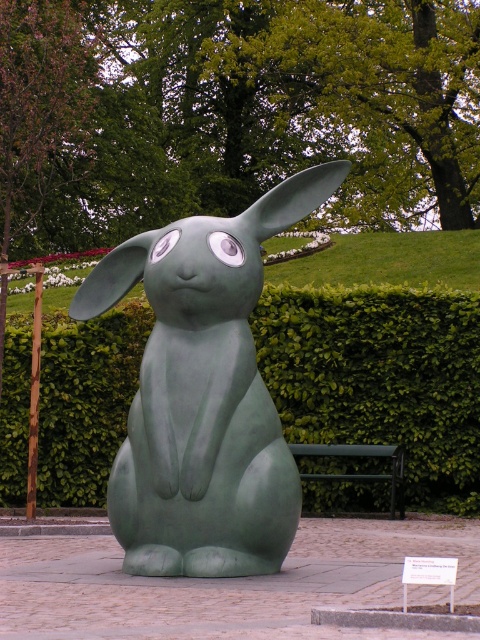
Is green leafy hedge at center shorter than green matte rabbit at center?

Yes, green leafy hedge at center is shorter than green matte rabbit at center.

How distant is green leafy hedge at center from green matte rabbit at center?

A distance of 6.25 meters exists between green leafy hedge at center and green matte rabbit at center.

The height and width of the screenshot is (640, 480). Identify the location of green leafy hedge at center. (380, 378).

Is green matte rabbit at center further to camera compared to green metal bench at center?

No, it is not.

Between point (153, 506) and point (325, 477), which one is positioned in front?

Point (153, 506)

Where is `green matte rabbit at center`? This screenshot has height=640, width=480. green matte rabbit at center is located at coordinates (204, 394).

Does green leafy hedge at center have a smaller size compared to green metal bench at center?

No, green leafy hedge at center is not smaller than green metal bench at center.

This screenshot has height=640, width=480. What do you see at coordinates (380, 378) in the screenshot? I see `green leafy hedge at center` at bounding box center [380, 378].

Locate an element on the screen. The height and width of the screenshot is (640, 480). green leafy hedge at center is located at coordinates (380, 378).

The width and height of the screenshot is (480, 640). I want to click on green leafy hedge at center, so click(x=380, y=378).